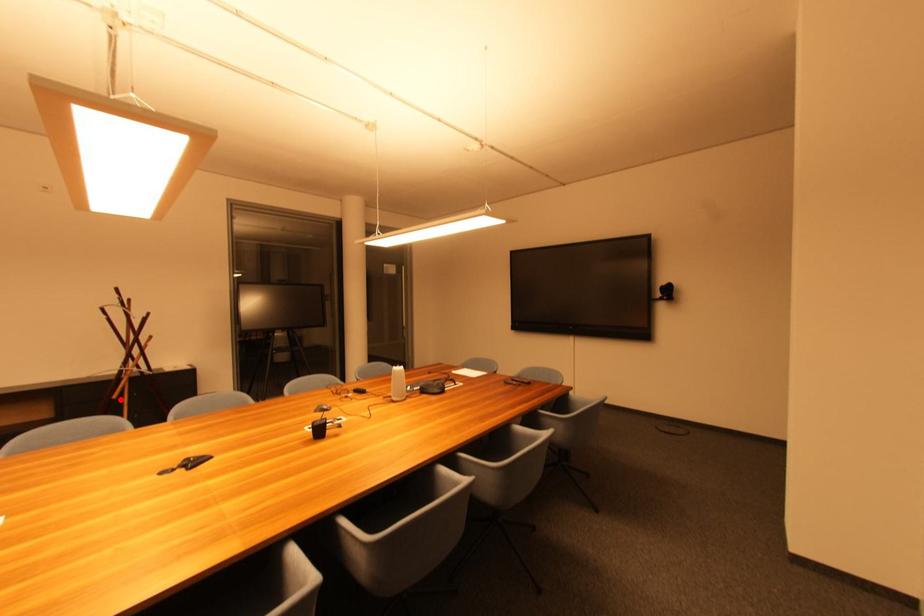
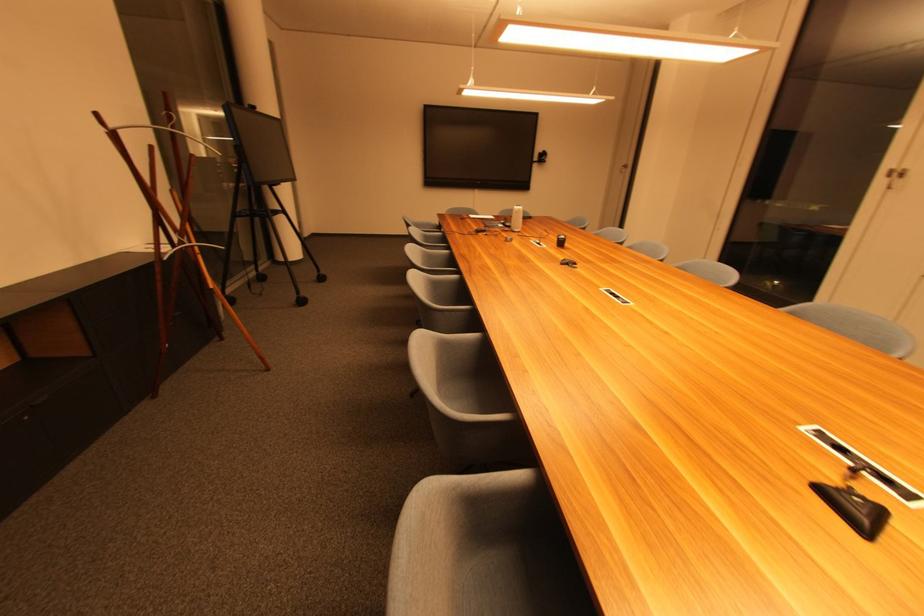
In the second image, find the point that corresponds to the highlighted location in the first image.

(216, 288)